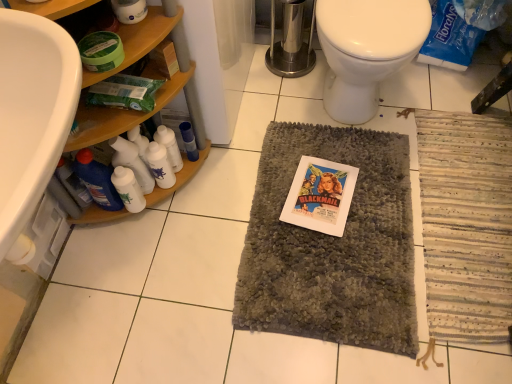
Find the location of a particular element. This screenshot has height=384, width=512. free space that is in between white glossy bottle at lower left, the second bottle in the left-to-right sequence, and gray shaggy mat at center is located at coordinates (x=211, y=216).